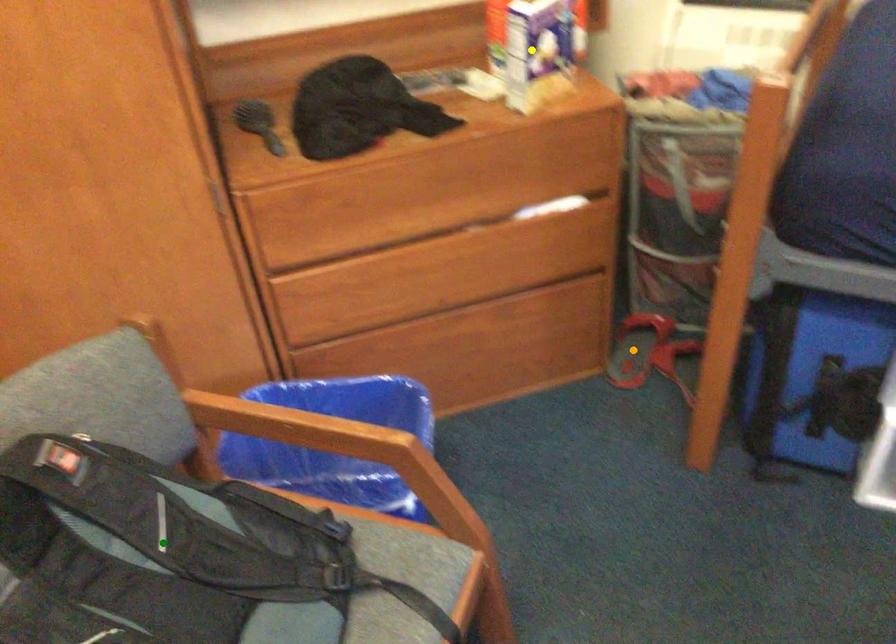
Order these from nearest to farthest:
yellow point, orange point, green point

green point < yellow point < orange point